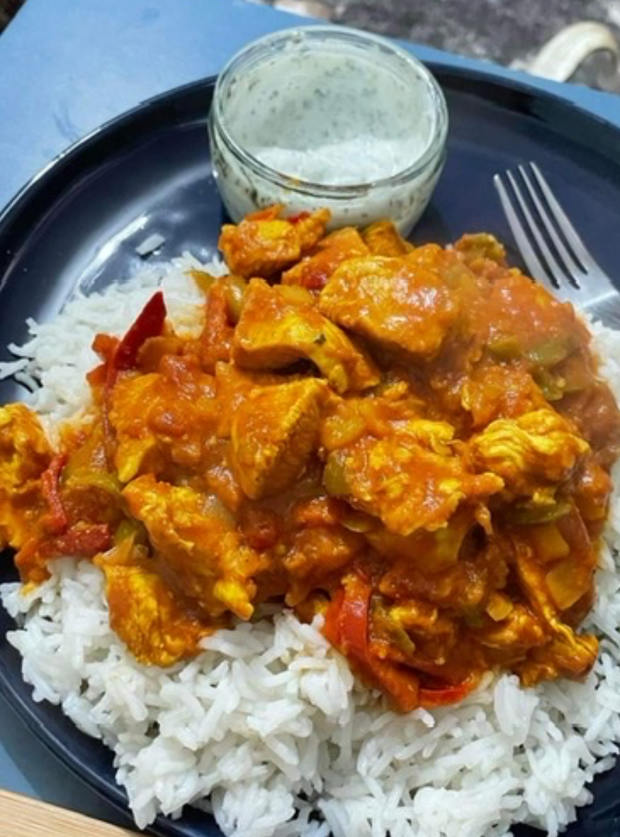
Identify the location of glass sauce jar. This screenshot has width=620, height=837. (374, 196).